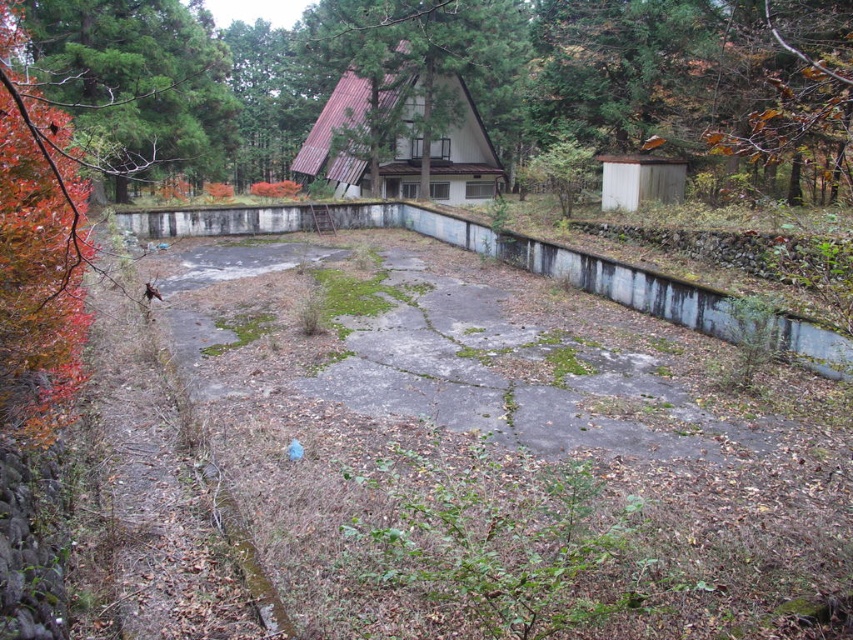
You are standing at the entrance of the house and want to locate the metallic brown roof at upper center. According to the coordinates provided, where should you look relative to your position?

The metallic brown roof at upper center is located at point coordinates (416, 93), which means you should look slightly to the left and upwards from your position at the entrance to find it.